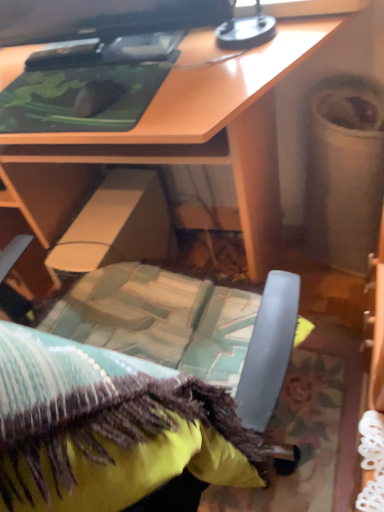
Where is `black glossy monitor at upper center`? This screenshot has width=384, height=512. black glossy monitor at upper center is located at coordinates (102, 18).

Describe the element at coordinates (102, 18) in the screenshot. I see `black glossy monitor at upper center` at that location.

You are a GUI agent. You are given a task and a screenshot of the screen. Output one action in this format:
    pyautogui.click(x=<x>, y=<y>)
    Task: Click on the black glossy monitor at upper center
    
    Given the screenshot: What is the action you would take?
    pyautogui.click(x=102, y=18)